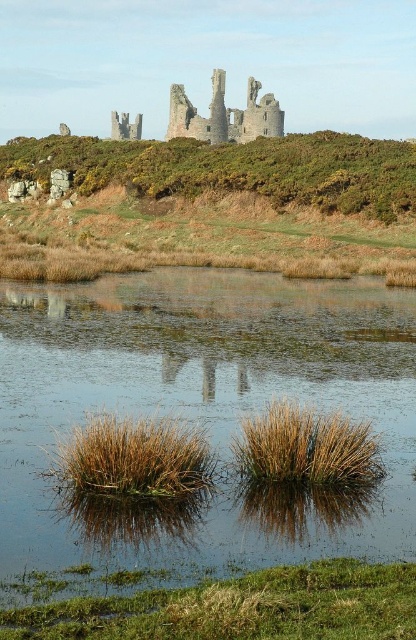
Question: Is brown grassy water at center to the left of brown grass at center from the viewer's perspective?

Choices:
 (A) yes
 (B) no

Answer: (A)

Question: From the image, what is the correct spatial relationship of brown grassy water at center in relation to brown grass at center?

Choices:
 (A) right
 (B) left

Answer: (B)

Question: Can you confirm if brown grassy water at center is positioned to the left of brown grass at lower center?

Choices:
 (A) yes
 (B) no

Answer: (B)

Question: Among these points, which one is nearest to the camera?

Choices:
 (A) (284, 195)
 (B) (259, 472)
 (C) (299, 378)

Answer: (B)

Question: Which object is farther from the camera taking this photo?

Choices:
 (A) brown grassy water at center
 (B) rustic stone castle at upper center

Answer: (B)

Question: Which is nearer to the brown grass at center?

Choices:
 (A) green shrubbery at upper center
 (B) brown grass at lower center
 (C) brown grassy water at center

Answer: (B)